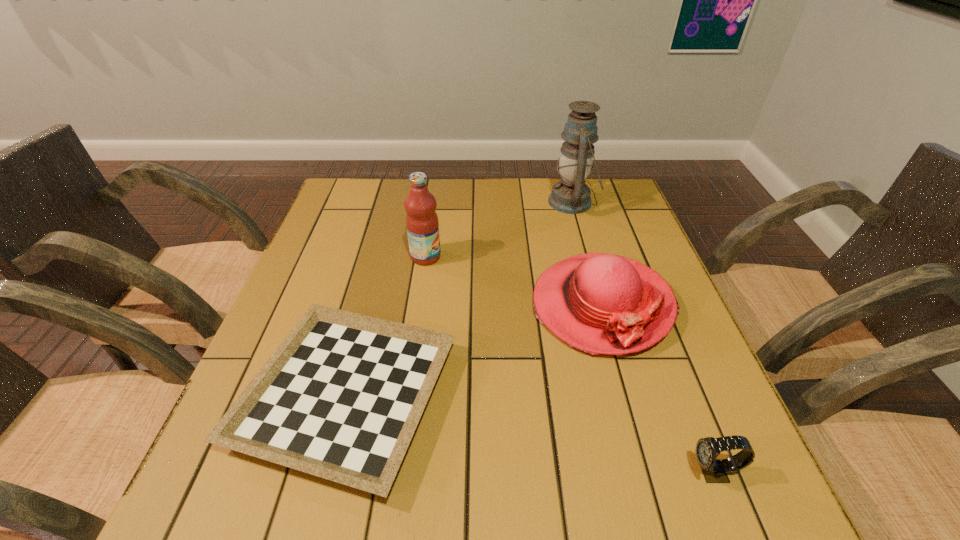
Where is `the farthest object`? the farthest object is located at coordinates (571, 195).

This screenshot has height=540, width=960. Identify the location of the tallest object. (571, 195).

This screenshot has height=540, width=960. I want to click on the second tallest object, so click(x=422, y=223).

At what (x,y) coordinates should I click in order to perform the action: click on hat. Please return your answer as a coordinate pair (x, y). Image resolution: width=960 pixels, height=540 pixels. Looking at the image, I should click on (599, 303).

At what (x,y) coordinates should I click in order to perform the action: click on the fourth tallest object. Please return your answer as a coordinate pair (x, y). The image size is (960, 540). Looking at the image, I should click on (714, 470).

Locate an element on the screen. the shortest object is located at coordinates (340, 398).

Locate an element on the screen. This screenshot has height=540, width=960. vacant space located on the left of the farthest object is located at coordinates (508, 202).

Where is `vacant space located 0.120m on the front label of the fruit juice`? The image size is (960, 540). vacant space located 0.120m on the front label of the fruit juice is located at coordinates (488, 256).

The height and width of the screenshot is (540, 960). What are the coordinates of `vacant space located at the front of the third shortest object with a bow` in the screenshot? It's located at (626, 392).

Locate an element on the screen. The width and height of the screenshot is (960, 540). vacant space located 0.190m on the face of the second shortest object is located at coordinates (573, 472).